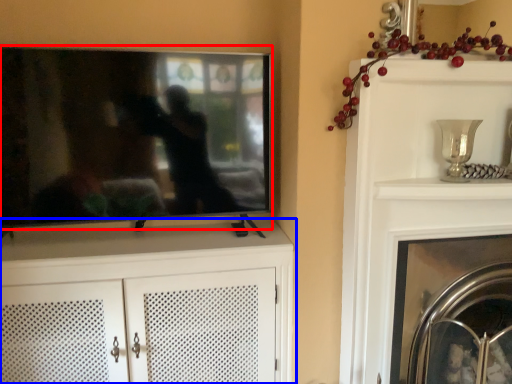
Question: Which object appears farthest to the camera in this image, television (highlighted by a red box) or cabinetry (highlighted by a blue box)?

Choices:
 (A) television
 (B) cabinetry

Answer: (B)